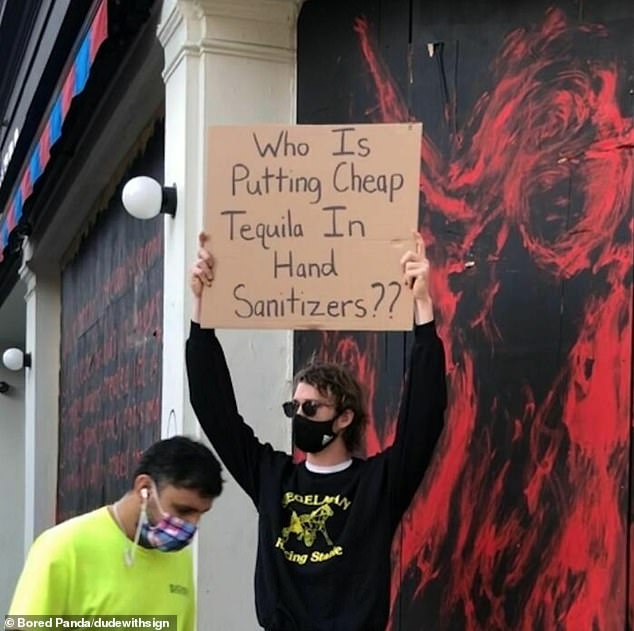
Identify the location of lights. The image size is (634, 631). (141, 192), (11, 350).